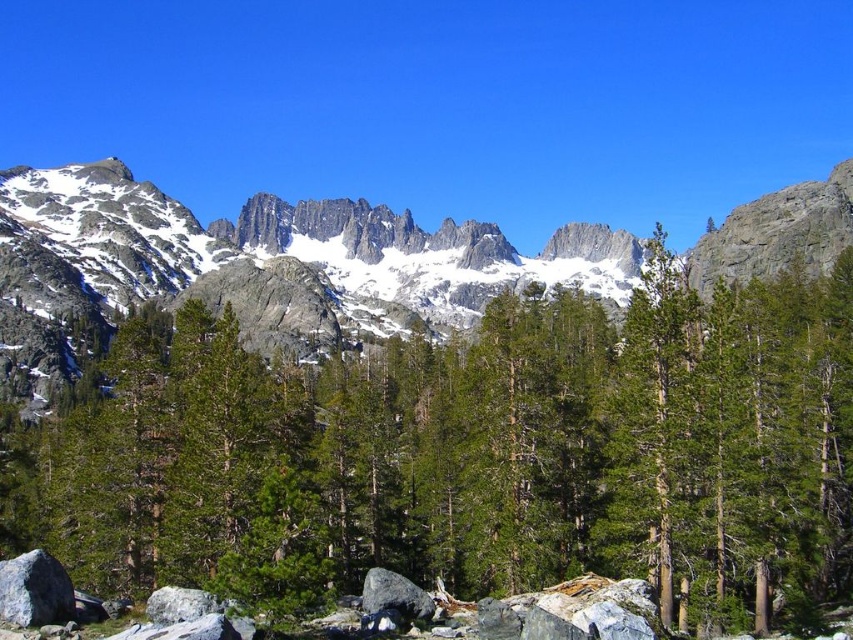
Who is more forward, (390, 445) or (50, 557)?

Point (50, 557)

Does green matte tree at center have a larger size compared to gray rough boulder at lower left?

Yes, green matte tree at center is bigger than gray rough boulder at lower left.

The width and height of the screenshot is (853, 640). Describe the element at coordinates (469, 456) in the screenshot. I see `green matte tree at center` at that location.

You are a GUI agent. You are given a task and a screenshot of the screen. Output one action in this format:
    pyautogui.click(x=<x>, y=<y>)
    Task: Click on the green matte tree at center
    This screenshot has width=853, height=640.
    Given the screenshot: What is the action you would take?
    pyautogui.click(x=469, y=456)

Can you confirm if green matte tree at center is smaller than snowy granite mountain at center?

Yes, green matte tree at center is smaller than snowy granite mountain at center.

In the scene shown: Can you confirm if green matte tree at center is positioned to the left of snowy granite mountain at center?

In fact, green matte tree at center is to the right of snowy granite mountain at center.

Is point (158, 509) less distant than point (798, 248)?

Yes, point (158, 509) is in front of point (798, 248).

This screenshot has width=853, height=640. In order to click on green matte tree at center in this screenshot , I will do `click(469, 456)`.

Between point (83, 292) and point (32, 609), which one is positioned in front?

Point (32, 609) is more forward.

Image resolution: width=853 pixels, height=640 pixels. I want to click on snowy granite mountain at center, so (257, 268).